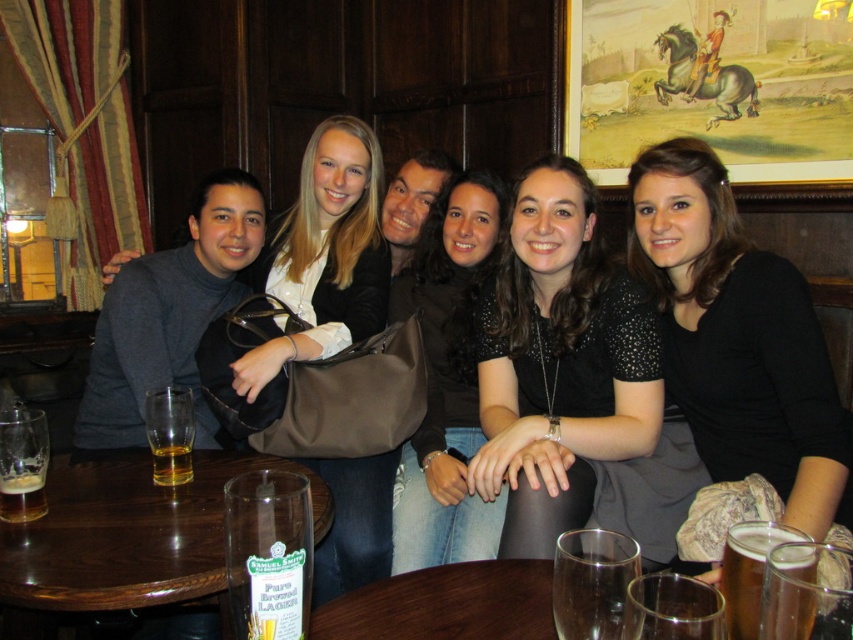
You are a waiter at the pub and need to place a new drink order on the table. The black leather purse at center is currently occupying space. Can you place the drink directly to the left of the clear glass beer at lower right without moving the purse?

The black leather purse at center is taller than the clear glass beer at lower right, but since the question is about placing the drink to the left of the beer, the height difference doesn not affect the horizontal space. Therefore, yes, you can place the drink directly to the left of the clear glass beer at lower right without moving the purse.

You are a photographer trying to capture a group photo of the six people seated at the brown wooden table at lower left and the black leather purse at center. Since the table is smaller, will it be challenging to fit everyone comfortably?

The brown wooden table at lower left has a smaller size compared to the black leather purse at center, so it might be challenging to fit everyone comfortably as the table may not provide enough space for six people.